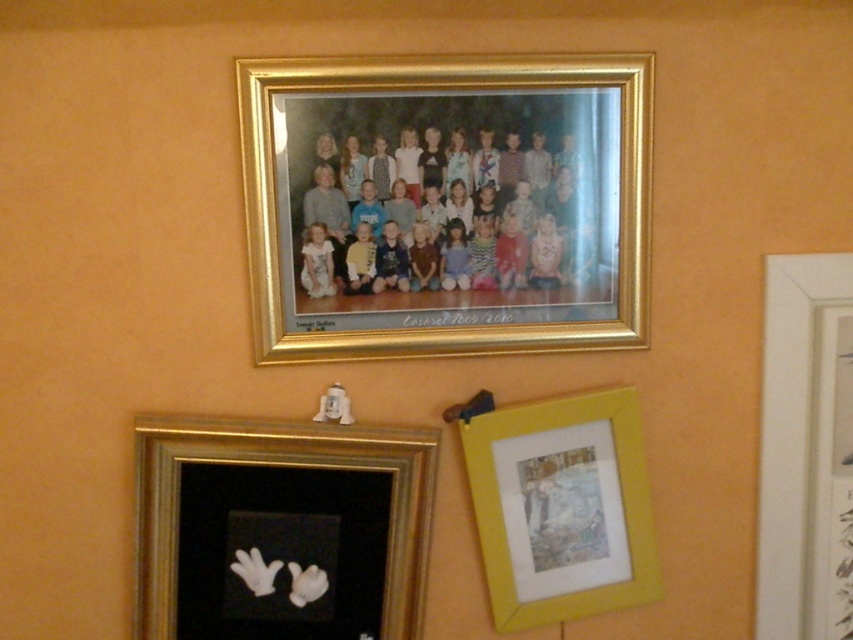
Question: Considering the real-world distances, which object is closest to the gold metallic photo frame at upper center?

Choices:
 (A) black velvet gloves at lower left
 (B) yellow matte picture frame at lower right
 (C) white matte picture frame at upper right
 (D) matte plastic children at center

Answer: (D)

Question: Which point is closer to the camera?

Choices:
 (A) (408, 506)
 (B) (763, 595)
 (C) (477, 499)
 (D) (496, 228)

Answer: (D)

Question: Is black velvet gloves at lower left in front of matte plastic children at center?

Choices:
 (A) no
 (B) yes

Answer: (A)

Question: Is gold metallic photo frame at upper center positioned at the back of yellow matte picture frame at lower right?

Choices:
 (A) no
 (B) yes

Answer: (A)

Question: Is black velvet gloves at lower left to the left of white matte picture frame at upper right from the viewer's perspective?

Choices:
 (A) yes
 (B) no

Answer: (A)

Question: Which point is farther from the camera taking this photo?

Choices:
 (A) (503, 444)
 (B) (383, 147)
 (C) (144, 636)

Answer: (A)